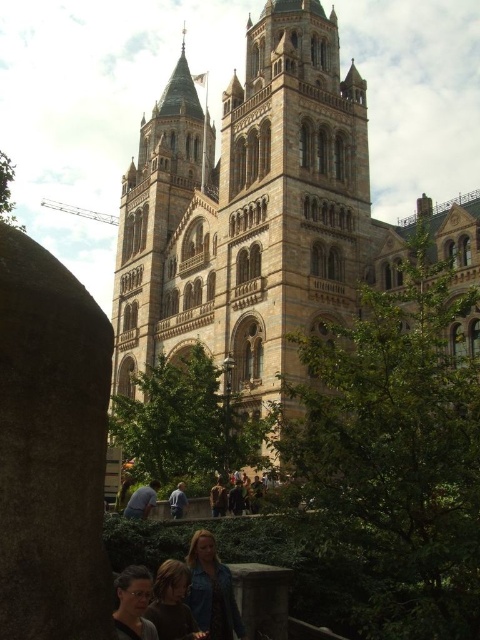
You are standing in front of the grand historic building and notice two points marked on the image. One is at coordinates point (166, 600) and the other at point (156, 481). Which point is nearer to your current position?

Point (166, 600) is closer to the camera than point (156, 481), so the point at coordinates point (166, 600) is nearer to your current position.

You are a photographer standing in front of the grand historic building with two towers. You notice two people wearing a dark brown leather jacket at lower center and a light blue shirt at lower center. From your vantage point, which clothing item is positioned lower in the image?

The dark brown leather jacket at lower center is located below the light blue shirt at lower center, so it is positioned lower in the image.